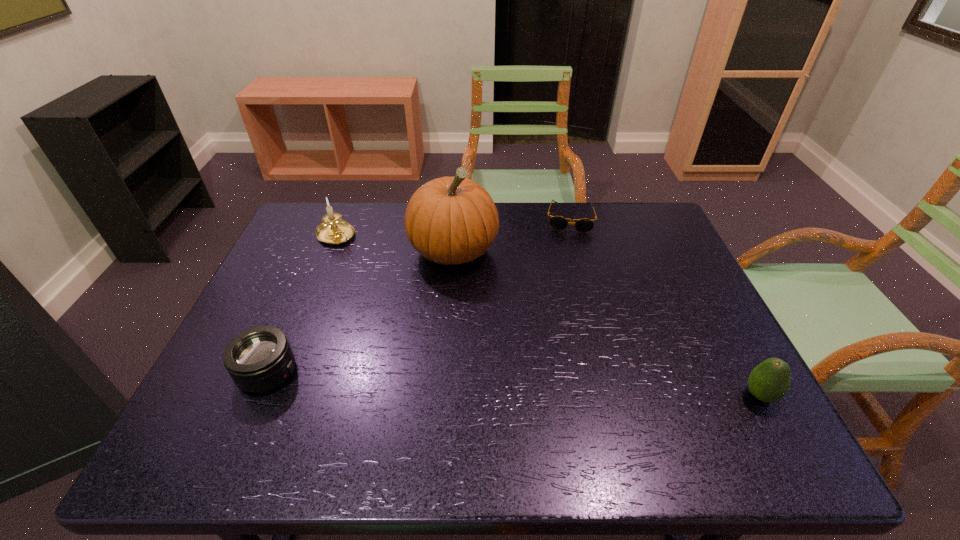
At what (x,y) coordinates should I click in order to perform the action: click on free space located on the stem of the third object from left to right. Please return your answer as a coordinate pair (x, y). Looking at the image, I should click on (490, 381).

Find the location of a particular element. vacant space situated on the stem of the third object from left to right is located at coordinates (475, 328).

The width and height of the screenshot is (960, 540). What are the coordinates of `vacant area located 0.050m on the stem of the third object from left to right` in the screenshot? It's located at (465, 292).

The width and height of the screenshot is (960, 540). In order to click on free space located on the lenses of the second object from right to left in this screenshot , I will do `click(565, 320)`.

Image resolution: width=960 pixels, height=540 pixels. In order to click on vacant space located 0.340m on the lenses of the second object from right to left in this screenshot , I will do `click(566, 311)`.

Locate an element on the screen. free location located on the lenses of the second object from right to left is located at coordinates (565, 326).

I want to click on free location located 0.240m on the handle side of the fourth shortest object, so click(389, 285).

The image size is (960, 540). Find the location of `free point located 0.330m on the handle side of the fourth shortest object`. free point located 0.330m on the handle side of the fourth shortest object is located at coordinates (408, 303).

Find the location of a particular element. The width and height of the screenshot is (960, 540). free space located on the handle side of the fourth shortest object is located at coordinates (377, 274).

Where is `pumpkin that is at the far edge`? Image resolution: width=960 pixels, height=540 pixels. pumpkin that is at the far edge is located at coordinates (451, 220).